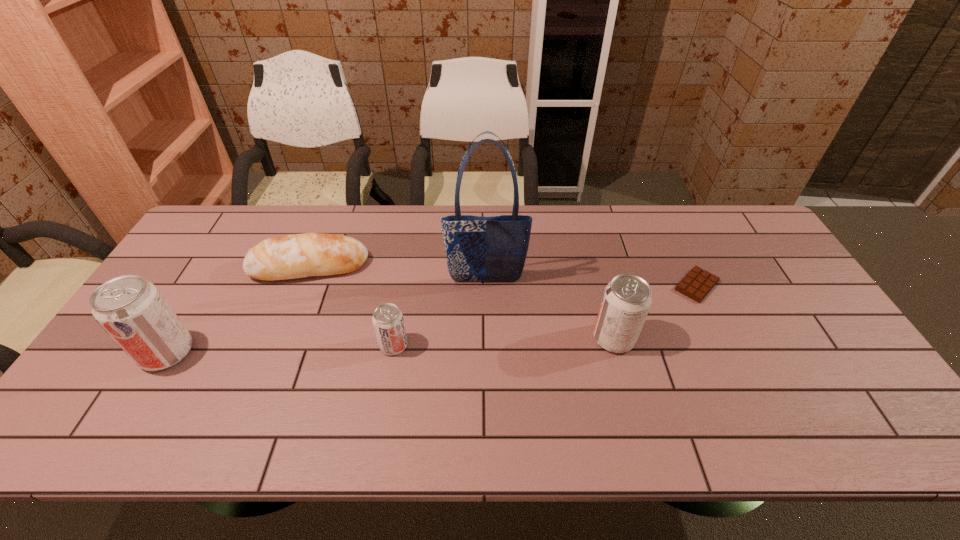
Identify the location of object located in the near left corner section of the desktop. (135, 314).

Find the location of a particular element. Image resolution: width=960 pixels, height=540 pixels. free space at the far edge of the desktop is located at coordinates (392, 236).

What are the coordinates of `vacant position at the near edge of the desktop` in the screenshot? It's located at (576, 376).

At what (x,y) coordinates should I click in order to perform the action: click on vacant space at the left edge of the desktop. Please return your answer as a coordinate pair (x, y). Image resolution: width=960 pixels, height=540 pixels. Looking at the image, I should click on (207, 286).

This screenshot has height=540, width=960. I want to click on vacant area at the far left corner of the desktop, so click(235, 206).

This screenshot has height=540, width=960. I want to click on vacant space at the near left corner, so click(150, 389).

The width and height of the screenshot is (960, 540). I want to click on free space at the near right corner, so click(847, 379).

Find the location of a particular element. This screenshot has width=960, height=540. free space between the second object from right to left and the second shortest object is located at coordinates (462, 302).

The height and width of the screenshot is (540, 960). I want to click on unoccupied area between the tallest object and the candy bar, so click(591, 283).

In order to click on unoccupied area between the leftmost soda can and the rightmost object in this screenshot , I will do `click(432, 319)`.